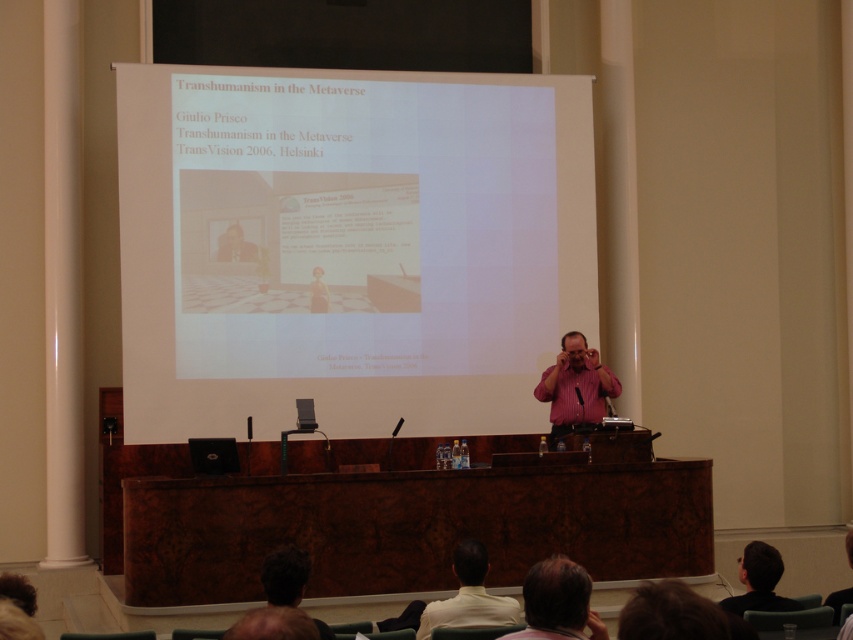
You are a photographer positioned at the camera. You need to capture a closeup shot of the presenter wearing the pink shirt at center. Based on the scene, can you get a clear closeup without moving the camera?

The pink shirt at center is 25.30 feet away from the camera. Since this distance is relatively far, you would need a telephoto lens to capture a clear closeup without moving the camera closer.

You are sitting in the audience at the presentation. You want to hand a note to the presenter who is standing at point (351, 429). If you are 30.07 feet away from him, is this distance within a typical speaking distance for a conversation?

The distance between you and the presenter at point (351, 429) is 30.07 feet. A typical speaking distance for conversation is around 3 to 10 feet. Therefore, this distance is too far for a typical speaking distance.